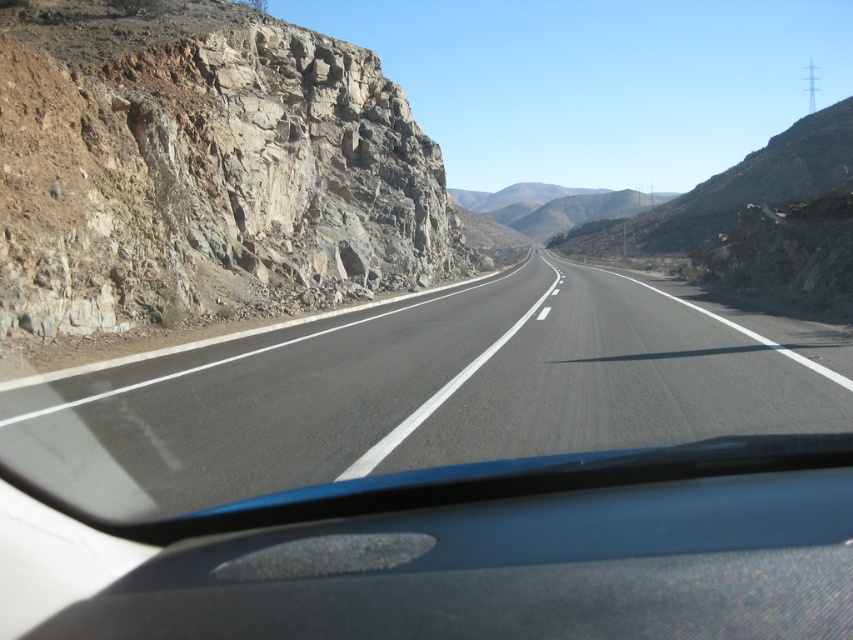
How far apart are rocky cliff at left and black asphalt road at center?

rocky cliff at left is 10.66 meters away from black asphalt road at center.

Can you confirm if rocky cliff at left is wider than black asphalt road at center?

Yes, rocky cliff at left is wider than black asphalt road at center.

Where is `rocky cliff at left`? The height and width of the screenshot is (640, 853). rocky cliff at left is located at coordinates (202, 170).